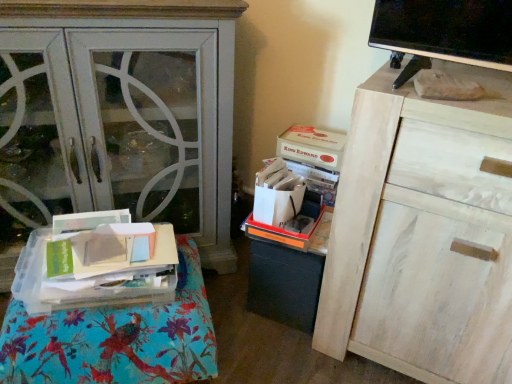
The height and width of the screenshot is (384, 512). Describe the element at coordinates (116, 339) in the screenshot. I see `clear plastic tray at lower left` at that location.

Locate an element on the screen. Image resolution: width=512 pixels, height=384 pixels. orange plastic storage box at center, which is the 1th storage box from bottom to top is located at coordinates click(294, 232).

Measure the distance between white wood cabinet at upper right and camera.

The depth of white wood cabinet at upper right is 30.99 inches.

Describe the element at coordinates (118, 115) in the screenshot. I see `matte white cabinet at left` at that location.

Find the location of `white cardboard box at upper center, placed as the second storage box when sorted from bottom to top`. white cardboard box at upper center, placed as the second storage box when sorted from bottom to top is located at coordinates (312, 146).

In the image, is clear plastic tray at lower left positioned in front of or behind white cardboard box at upper center, the first storage box when ordered from top to bottom?

In the image, clear plastic tray at lower left appears in front of white cardboard box at upper center, the first storage box when ordered from top to bottom.

Looking at this image, is white cardboard box at upper center, the first storage box when ordered from top to bottom, completely or partially inside clear plastic tray at lower left?

That's incorrect, white cardboard box at upper center, the first storage box when ordered from top to bottom, is not inside clear plastic tray at lower left.

From the image's perspective, does clear plastic tray at lower left appear higher than white cardboard box at upper center, placed as the second storage box when sorted from bottom to top?

Actually, clear plastic tray at lower left appears below white cardboard box at upper center, placed as the second storage box when sorted from bottom to top, in the image.

Visually, is clear plastic tray at lower left positioned to the left or to the right of white cardboard box at upper center, the first storage box when ordered from top to bottom?

clear plastic tray at lower left is to the left of white cardboard box at upper center, the first storage box when ordered from top to bottom.

Could you measure the distance between orange plastic storage box at center, which is counted as the 2th storage box, starting from the top, and clear plastic tray at lower left?

orange plastic storage box at center, which is counted as the 2th storage box, starting from the top, is 16.11 inches from clear plastic tray at lower left.

Could you tell me if orange plastic storage box at center, which is counted as the 2th storage box, starting from the top, is facing clear plastic tray at lower left?

No, orange plastic storage box at center, which is counted as the 2th storage box, starting from the top, is not turned towards clear plastic tray at lower left.

Is orange plastic storage box at center, which is counted as the 2th storage box, starting from the top, not within clear plastic tray at lower left?

Absolutely, orange plastic storage box at center, which is counted as the 2th storage box, starting from the top, is external to clear plastic tray at lower left.

Find the location of `the 1st storage box behind when counting from the clear plastic tray at lower left`. the 1st storage box behind when counting from the clear plastic tray at lower left is located at coordinates (294, 232).

How much distance is there between matte white cabinet at left and orange plastic storage box at center, which is counted as the 2th storage box, starting from the top?

A distance of 19.81 inches exists between matte white cabinet at left and orange plastic storage box at center, which is counted as the 2th storage box, starting from the top.

Is point (44, 158) closer to camera compared to point (291, 243)?

No.

Could you tell me if matte white cabinet at left is turned towards orange plastic storage box at center, which is counted as the 2th storage box, starting from the top?

No, matte white cabinet at left is not facing towards orange plastic storage box at center, which is counted as the 2th storage box, starting from the top.

Which of these two, matte white cabinet at left or orange plastic storage box at center, which is the 1th storage box from bottom to top, stands taller?

Standing taller between the two is matte white cabinet at left.

Between white cardboard box at upper center, the first storage box when ordered from top to bottom, and orange plastic storage box at center, which is the 1th storage box from bottom to top, which one appears on the left side from the viewer's perspective?

orange plastic storage box at center, which is the 1th storage box from bottom to top, is more to the left.

This screenshot has height=384, width=512. What are the coordinates of `storage box above the orange plastic storage box at center, which is the 1th storage box from bottom to top (from a real-world perspective)` in the screenshot? It's located at (312, 146).

Is white cardboard box at upper center, placed as the second storage box when sorted from bottom to top, not within orange plastic storage box at center, which is the 1th storage box from bottom to top?

Yes, white cardboard box at upper center, placed as the second storage box when sorted from bottom to top, is not within orange plastic storage box at center, which is the 1th storage box from bottom to top.

Where is `furniture below the white cardboard box at upper center, placed as the second storage box when sorted from bottom to top (from a real-world perspective)`? This screenshot has height=384, width=512. furniture below the white cardboard box at upper center, placed as the second storage box when sorted from bottom to top (from a real-world perspective) is located at coordinates (116, 339).

Is white cardboard box at upper center, placed as the second storage box when sorted from bottom to top, aimed at clear plastic tray at lower left?

No, white cardboard box at upper center, placed as the second storage box when sorted from bottom to top, is not facing towards clear plastic tray at lower left.

From a real-world perspective, which object stands above the other?

From a 3D spatial view, white cardboard box at upper center, placed as the second storage box when sorted from bottom to top, is above.

Which is behind, point (320, 139) or point (185, 275)?

The point (320, 139) is farther.

From the image's perspective, between orange plastic storage box at center, which is counted as the 2th storage box, starting from the top, and white wood cabinet at upper right, which one is located above?

From the image's view, orange plastic storage box at center, which is counted as the 2th storage box, starting from the top, is above.

The image size is (512, 384). Find the location of `storage box below the white wood cabinet at upper right (from a real-world perspective)`. storage box below the white wood cabinet at upper right (from a real-world perspective) is located at coordinates (294, 232).

Looking at this image, what's the angular difference between orange plastic storage box at center, which is counted as the 2th storage box, starting from the top, and white wood cabinet at upper right's facing directions?

orange plastic storage box at center, which is counted as the 2th storage box, starting from the top, and white wood cabinet at upper right are facing 5.02 degrees away from each other.

Which is nearer, (281, 245) or (400, 367)?

Point (281, 245) is positioned farther from the camera compared to point (400, 367).

Considering the relative sizes of matte white cabinet at left and white cardboard box at upper center, the first storage box when ordered from top to bottom, in the image provided, is matte white cabinet at left taller than white cardboard box at upper center, the first storage box when ordered from top to bottom,?

Indeed, matte white cabinet at left has a greater height compared to white cardboard box at upper center, the first storage box when ordered from top to bottom.

Is the position of matte white cabinet at left less distant than that of white cardboard box at upper center, the first storage box when ordered from top to bottom?

Yes, the depth of matte white cabinet at left is less than that of white cardboard box at upper center, the first storage box when ordered from top to bottom.

From the image's perspective, which one is positioned higher, matte white cabinet at left or white cardboard box at upper center, placed as the second storage box when sorted from bottom to top?

From the image's view, matte white cabinet at left is above.

Measure the distance between matte white cabinet at left and white cardboard box at upper center, the first storage box when ordered from top to bottom.

They are 20.27 inches apart.

Which storage box is the 2nd one when counting from the back of the clear plastic tray at lower left? Please provide its 2D coordinates.

[(312, 146)]

This screenshot has height=384, width=512. I want to click on furniture that appears below the orange plastic storage box at center, which is the 1th storage box from bottom to top (from the image's perspective), so click(x=116, y=339).

Based on their spatial positions, is clear plastic tray at lower left or white cardboard box at upper center, placed as the second storage box when sorted from bottom to top, further from orange plastic storage box at center, which is the 1th storage box from bottom to top?

clear plastic tray at lower left is further to orange plastic storage box at center, which is the 1th storage box from bottom to top.

Based on their spatial positions, is clear plastic tray at lower left or orange plastic storage box at center, which is the 1th storage box from bottom to top, further from white cardboard box at upper center, placed as the second storage box when sorted from bottom to top?

clear plastic tray at lower left lies further to white cardboard box at upper center, placed as the second storage box when sorted from bottom to top, than the other object.

Which object lies further to the anchor point white wood cabinet at upper right, white cardboard box at upper center, the first storage box when ordered from top to bottom, or matte white cabinet at left?

The object further to white wood cabinet at upper right is matte white cabinet at left.

Looking at the image, which one is located further to matte white cabinet at left, orange plastic storage box at center, which is the 1th storage box from bottom to top, or white wood cabinet at upper right?

white wood cabinet at upper right is further to matte white cabinet at left.

Based on their spatial positions, is orange plastic storage box at center, which is counted as the 2th storage box, starting from the top, or matte white cabinet at left further from white wood cabinet at upper right?

matte white cabinet at left lies further to white wood cabinet at upper right than the other object.

Based on their spatial positions, is clear plastic tray at lower left or matte white cabinet at left closer to orange plastic storage box at center, which is the 1th storage box from bottom to top?

Based on the image, clear plastic tray at lower left appears to be nearer to orange plastic storage box at center, which is the 1th storage box from bottom to top.

From the image, which object appears to be farther from clear plastic tray at lower left, white wood cabinet at upper right or orange plastic storage box at center, which is the 1th storage box from bottom to top?

white wood cabinet at upper right is further to clear plastic tray at lower left.

Based on their spatial positions, is clear plastic tray at lower left or orange plastic storage box at center, which is counted as the 2th storage box, starting from the top, further from matte white cabinet at left?

orange plastic storage box at center, which is counted as the 2th storage box, starting from the top, is further to matte white cabinet at left.

Identify the location of storage box between matte white cabinet at left and white cardboard box at upper center, the first storage box when ordered from top to bottom. (294, 232).

Where is `storage box between white wood cabinet at upper right and white cardboard box at upper center, placed as the second storage box when sorted from bottom to top, in the front-back direction`? This screenshot has height=384, width=512. storage box between white wood cabinet at upper right and white cardboard box at upper center, placed as the second storage box when sorted from bottom to top, in the front-back direction is located at coordinates (294, 232).

Identify the location of storage box between clear plastic tray at lower left and white cardboard box at upper center, the first storage box when ordered from top to bottom. (294, 232).

Identify the location of furniture between matte white cabinet at left and white cardboard box at upper center, placed as the second storage box when sorted from bottom to top, in the horizontal direction. The image size is (512, 384). (116, 339).